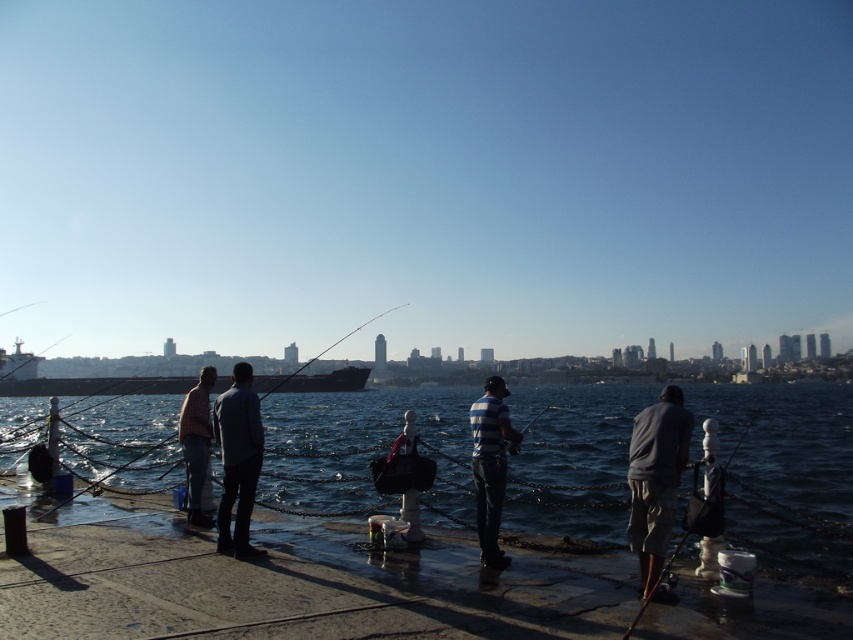
Can you confirm if dark blue water at center is taller than striped cotton shirt at center?

Correct, dark blue water at center is much taller as striped cotton shirt at center.

Is dark blue water at center smaller than striped cotton shirt at center?

Actually, dark blue water at center might be larger than striped cotton shirt at center.

Measure the distance between dark blue water at center and camera.

dark blue water at center and camera are 6.78 meters apart.

Locate an element on the screen. Image resolution: width=853 pixels, height=640 pixels. dark blue water at center is located at coordinates (784, 467).

Is dark blue jeans at center shorter than striped cotton shirt at center?

A: Indeed, dark blue jeans at center has a lesser height compared to striped cotton shirt at center.

This screenshot has height=640, width=853. Find the location of `dark blue jeans at center`. dark blue jeans at center is located at coordinates (238, 460).

Measure the distance between point (229, 496) and camera.

They are 7.83 meters apart.

At what (x,y) coordinates should I click in order to perform the action: click on dark blue jeans at center. Please return your answer as a coordinate pair (x, y). Image resolution: width=853 pixels, height=640 pixels. Looking at the image, I should click on (238, 460).

Who is positioned more to the right, dark blue water at center or matte striped shirt at left?

dark blue water at center is more to the right.

What are the coordinates of `dark blue water at center` in the screenshot? It's located at (784, 467).